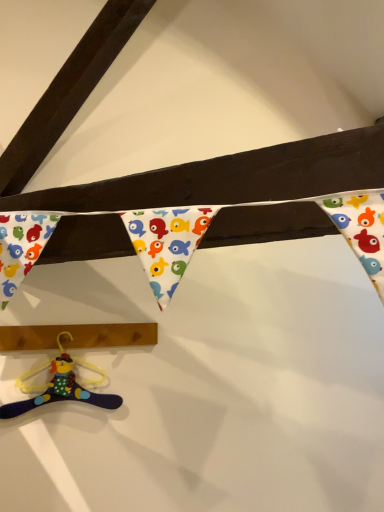
Question: Should I look upward or downward to see wooden plank at lower left?

Choices:
 (A) up
 (B) down

Answer: (B)

Question: Does velvety purple hanger at lower left touch wooden plank at lower left?

Choices:
 (A) no
 (B) yes

Answer: (A)

Question: Is the position of velvety purple hanger at lower left less distant than that of wooden plank at lower left?

Choices:
 (A) yes
 (B) no

Answer: (A)

Question: Is velvety purple hanger at lower left far away from wooden plank at lower left?

Choices:
 (A) no
 (B) yes

Answer: (A)

Question: Would you say velvety purple hanger at lower left is outside wooden plank at lower left?

Choices:
 (A) no
 (B) yes

Answer: (B)

Question: Can you confirm if velvety purple hanger at lower left is wider than wooden plank at lower left?

Choices:
 (A) no
 (B) yes

Answer: (A)

Question: Is velvety purple hanger at lower left bigger than wooden plank at lower left?

Choices:
 (A) no
 (B) yes

Answer: (A)

Question: From a real-world perspective, is wooden plank at lower left positioned under velvety purple hanger at lower left based on gravity?

Choices:
 (A) no
 (B) yes

Answer: (A)

Question: Is wooden plank at lower left oriented away from velvety purple hanger at lower left?

Choices:
 (A) yes
 (B) no

Answer: (B)

Question: Is wooden plank at lower left closer to the viewer compared to velvety purple hanger at lower left?

Choices:
 (A) yes
 (B) no

Answer: (B)

Question: Is wooden plank at lower left positioned far away from velvety purple hanger at lower left?

Choices:
 (A) yes
 (B) no

Answer: (B)

Question: Does wooden plank at lower left have a lesser height compared to velvety purple hanger at lower left?

Choices:
 (A) no
 (B) yes

Answer: (B)

Question: Are wooden plank at lower left and velvety purple hanger at lower left beside each other?

Choices:
 (A) no
 (B) yes

Answer: (A)

Question: From a real-world perspective, is velvety purple hanger at lower left above or below wooden plank at lower left?

Choices:
 (A) above
 (B) below

Answer: (B)